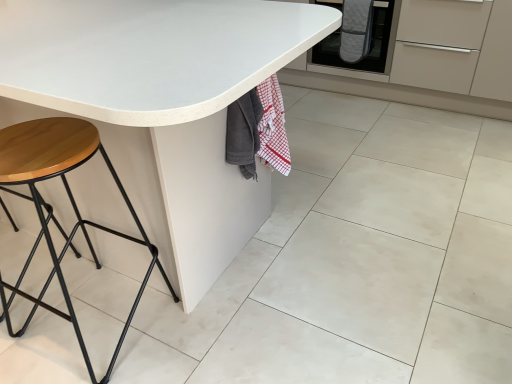
At what (x,y) coordinates should I click in order to perform the action: click on free space above wooden/matte stool at left (from a real-world perspective). Please return your answer as a coordinate pair (x, y). Looking at the image, I should click on (42, 140).